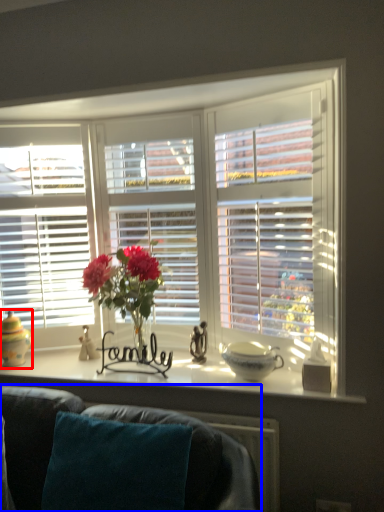
Question: Which object appears closest to the camera in this image, candle holder (highlighted by a red box) or studio couch (highlighted by a blue box)?

Choices:
 (A) candle holder
 (B) studio couch

Answer: (B)